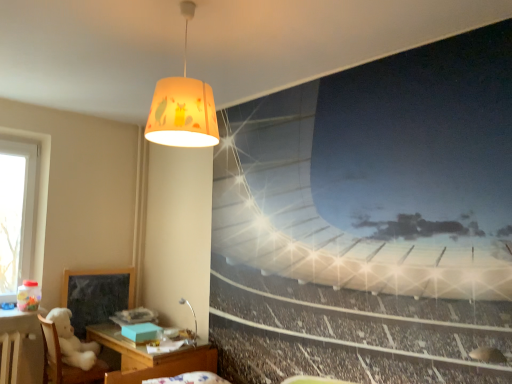
Question: Does metallic silver desk lamp at lower center, the 2th lamp in the front-to-back sequence, have a lesser height compared to white plush bear at lower left?

Choices:
 (A) yes
 (B) no

Answer: (A)

Question: Is metallic silver desk lamp at lower center, arranged as the 1th lamp when ordered from the bottom, surrounding white plush bear at lower left?

Choices:
 (A) yes
 (B) no

Answer: (B)

Question: Is metallic silver desk lamp at lower center, which is the 1th lamp in back-to-front order, further to the viewer compared to white plush bear at lower left?

Choices:
 (A) no
 (B) yes

Answer: (B)

Question: From a real-world perspective, is metallic silver desk lamp at lower center, the 2th lamp in the front-to-back sequence, over white plush bear at lower left?

Choices:
 (A) yes
 (B) no

Answer: (A)

Question: Considering the relative sizes of metallic silver desk lamp at lower center, which is the 1th lamp in back-to-front order, and white plush bear at lower left in the image provided, is metallic silver desk lamp at lower center, which is the 1th lamp in back-to-front order, smaller than white plush bear at lower left?

Choices:
 (A) yes
 (B) no

Answer: (A)

Question: From a real-world perspective, is metallic silver desk lamp at lower center, arranged as the 1th lamp when ordered from the bottom, physically located above or below white plush bear at lower left?

Choices:
 (A) below
 (B) above

Answer: (B)

Question: In terms of size, does metallic silver desk lamp at lower center, which is the 1th lamp in back-to-front order, appear bigger or smaller than white plush bear at lower left?

Choices:
 (A) small
 (B) big

Answer: (A)

Question: Is metallic silver desk lamp at lower center, which is the second lamp from top to bottom, inside or outside of white plush bear at lower left?

Choices:
 (A) inside
 (B) outside

Answer: (B)

Question: In the image, is metallic silver desk lamp at lower center, arranged as the 1th lamp when ordered from the bottom, positioned in front of or behind white plush bear at lower left?

Choices:
 (A) front
 (B) behind

Answer: (B)

Question: Is dark gray matte bulletin board at lower left taller or shorter than matte yellow fabric lampshade at upper center, which is counted as the first lamp, starting from the front?

Choices:
 (A) tall
 (B) short

Answer: (A)

Question: Considering their positions, is dark gray matte bulletin board at lower left located in front of or behind matte yellow fabric lampshade at upper center, which is counted as the 2th lamp, starting from the bottom?

Choices:
 (A) front
 (B) behind

Answer: (B)

Question: In the image, is dark gray matte bulletin board at lower left on the left side or the right side of matte yellow fabric lampshade at upper center, which is counted as the first lamp, starting from the front?

Choices:
 (A) right
 (B) left

Answer: (B)

Question: Considering the positions of point (82, 294) and point (198, 84), is point (82, 294) closer or farther from the camera than point (198, 84)?

Choices:
 (A) closer
 (B) farther

Answer: (B)

Question: Relative to dark gray matte bulletin board at lower left, is metallic silver desk lamp at lower center, arranged as the 1th lamp when ordered from the bottom, in front or behind?

Choices:
 (A) behind
 (B) front

Answer: (B)

Question: Visually, is metallic silver desk lamp at lower center, arranged as the 1th lamp when ordered from the bottom, positioned to the left or to the right of dark gray matte bulletin board at lower left?

Choices:
 (A) right
 (B) left

Answer: (A)